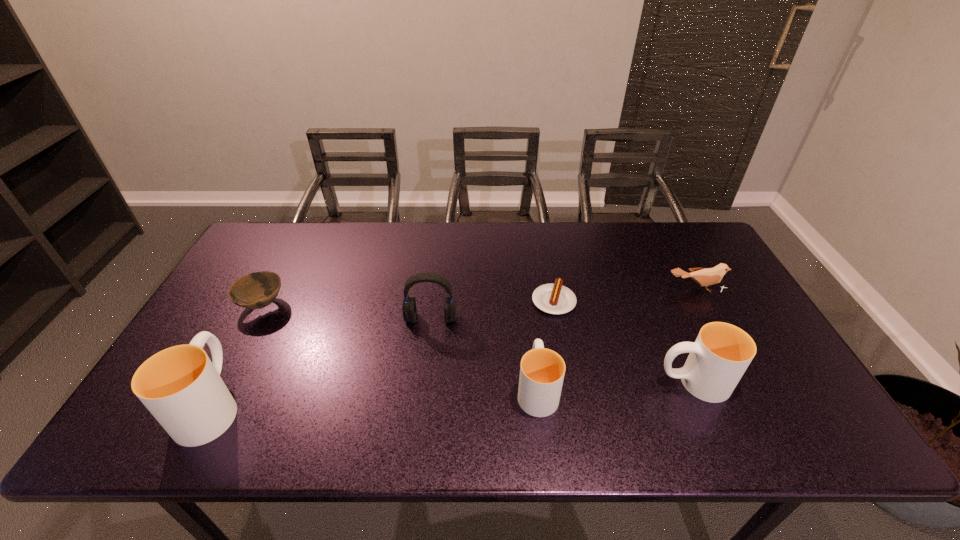
Image resolution: width=960 pixels, height=540 pixels. What are the coordinates of `cup that stands as the second closest to the leftmost cup` in the screenshot? It's located at click(722, 352).

Identify which cup is the closest to the third object from left to right. Please provide its 2D coordinates. Your answer should be formatted as a tuple, i.e. [(x, y)], where the tuple contains the x and y coordinates of a point satisfying the conditions above.

[(542, 370)]

Where is `free space in the image that satisfies the following two spatial constraints: 1. with the handle on the side of the leftmost cup; 2. with the handle on the side of the rightmost cup`? The image size is (960, 540). free space in the image that satisfies the following two spatial constraints: 1. with the handle on the side of the leftmost cup; 2. with the handle on the side of the rightmost cup is located at coordinates (224, 382).

At what (x,y) coordinates should I click in order to perform the action: click on vacant area in the image that satisfies the following two spatial constraints: 1. on the headband of the fifth object from right to left; 2. with the handle on the side of the second shortest cup. Please return your answer as a coordinate pair (x, y). Image resolution: width=960 pixels, height=540 pixels. Looking at the image, I should click on (423, 382).

You are a GUI agent. You are given a task and a screenshot of the screen. Output one action in this format:
    pyautogui.click(x=<x>, y=<y>)
    Task: Click on the free space that satisfies the following two spatial constraints: 1. with the handle on the side of the second cup from right to left; 2. with the handle on the side of the second tallest cup
    The image size is (960, 540).
    Given the screenshot: What is the action you would take?
    pyautogui.click(x=537, y=382)

Where is `free spot that satisfies the following two spatial constraints: 1. with the handle on the side of the leftmost cup; 2. with the handle on the side of the second tallest cup`? This screenshot has height=540, width=960. free spot that satisfies the following two spatial constraints: 1. with the handle on the side of the leftmost cup; 2. with the handle on the side of the second tallest cup is located at coordinates (224, 382).